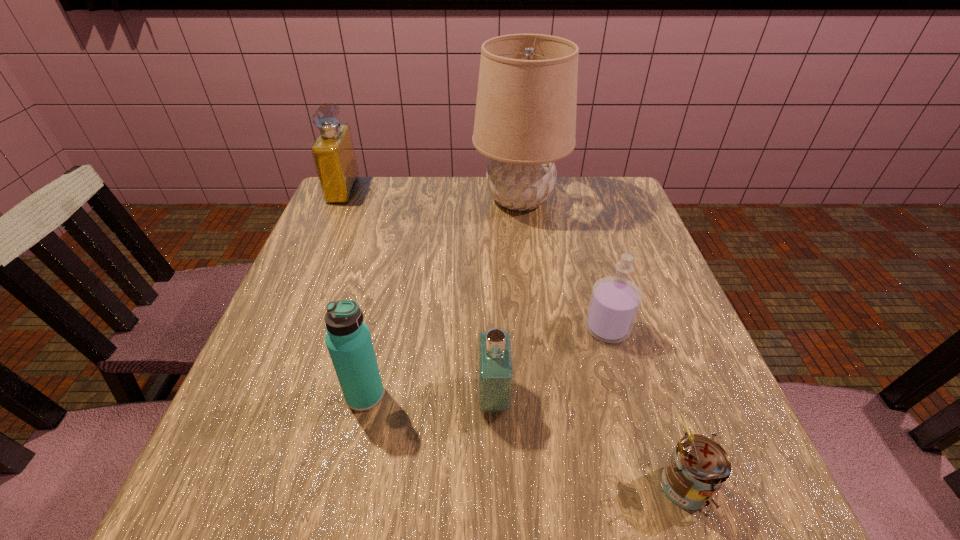
Locate which object is the second closest to the fifth object from right to left. Please provide its 2D coordinates. Your answer should be formatted as a tuple, i.e. [(x, y)], where the tuple contains the x and y coordinates of a point satisfying the conditions above.

[(615, 301)]

Identify the location of perfume that can be found as the second closest to the fifth object from right to left. The height and width of the screenshot is (540, 960). (615, 301).

You are a GUI agent. You are given a task and a screenshot of the screen. Output one action in this format:
    pyautogui.click(x=<x>, y=<y>)
    Task: Click on the third closest perfume to the lampshade
    
    Given the screenshot: What is the action you would take?
    tap(495, 363)

Locate an element on the screen. The height and width of the screenshot is (540, 960). blank area in the image that satisfies the following two spatial constraints: 1. on the front label of the second perfume from right to left; 2. on the back side of the shortest object is located at coordinates (495, 484).

This screenshot has width=960, height=540. What are the coordinates of `blank area in the image that satisfies the following two spatial constraints: 1. on the front-facing side of the can; 2. on the left side of the leftmost object` in the screenshot? It's located at (214, 484).

Locate an element on the screen. Image resolution: width=960 pixels, height=540 pixels. vacant space that satisfies the following two spatial constraints: 1. on the front label of the nearest perfume; 2. on the left side of the can is located at coordinates (495, 484).

In order to click on vacant position in the image that satisfies the following two spatial constraints: 1. on the back side of the fifth object from right to left; 2. on the left side of the third farthest object in this screenshot , I will do `click(380, 328)`.

At what (x,y) coordinates should I click in order to perform the action: click on free location that satisfies the following two spatial constraints: 1. on the front-facing side of the lampshade; 2. on the left side of the leftmost perfume. Please return your answer as a coordinate pair (x, y). This screenshot has height=540, width=960. Looking at the image, I should click on (339, 199).